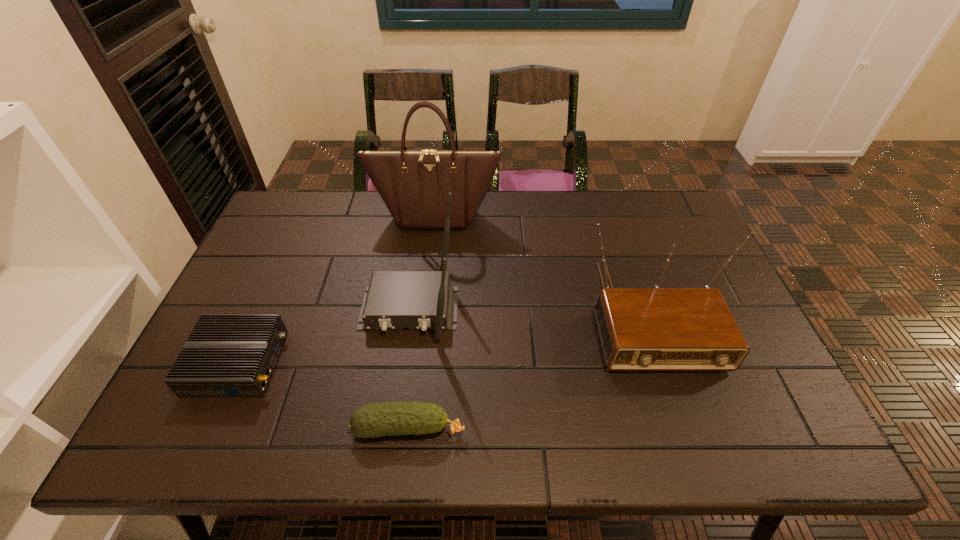
Where is `the farthest object`? the farthest object is located at coordinates (414, 184).

Identify the location of handbag. (414, 184).

In order to click on the rightmost object in this screenshot , I will do [641, 329].

Where is `the taller router`? Image resolution: width=960 pixels, height=540 pixels. the taller router is located at coordinates (419, 300).

The height and width of the screenshot is (540, 960). Find the location of `the shorter router`. the shorter router is located at coordinates (227, 355).

Identify the location of the left router. The height and width of the screenshot is (540, 960). tap(227, 355).

Where is `the nearest object`? The width and height of the screenshot is (960, 540). the nearest object is located at coordinates (377, 419).

The width and height of the screenshot is (960, 540). I want to click on vacant region located on the front-facing side of the farthest object, so [x=423, y=316].

The width and height of the screenshot is (960, 540). Find the location of `free location located 0.140m on the front panel of the rightmost object`. free location located 0.140m on the front panel of the rightmost object is located at coordinates (685, 430).

I want to click on free space located on the back of the right router to connect cables, so click(x=396, y=400).